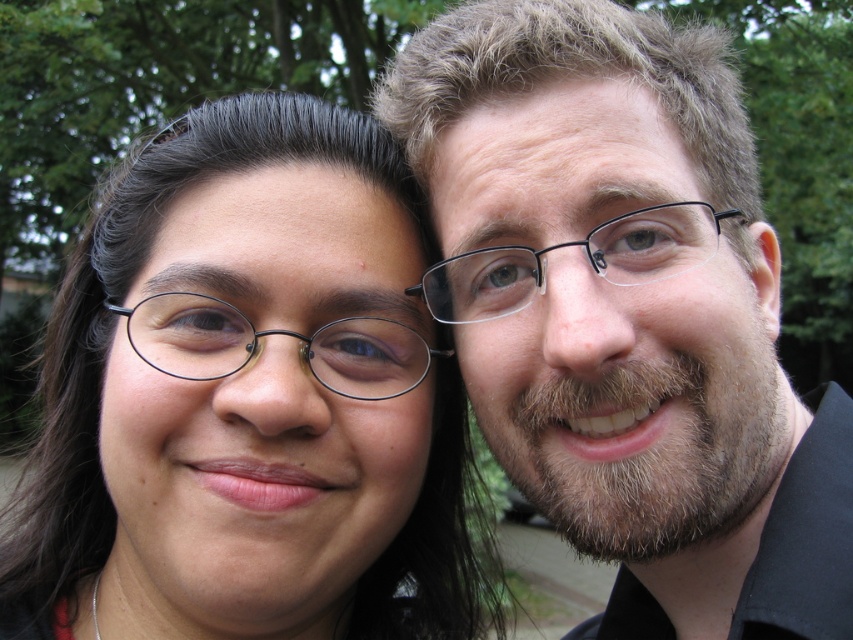
Between smooth black shirt at center and black plastic glasses at center, which one is positioned lower?

smooth black shirt at center is below.

Can you confirm if smooth black shirt at center is thinner than black plastic glasses at center?

No.

Who is more distant from viewer, (686, 355) or (602, 273)?

The point (686, 355) is more distant.

Locate an element on the screen. smooth black shirt at center is located at coordinates (627, 312).

Consider the image. Who is more distant from viewer, [357,342] or [631,220]?

The point [357,342] is more distant.

Which is behind, point (397, 324) or point (697, 208)?

Positioned behind is point (397, 324).

This screenshot has width=853, height=640. Identify the location of black plastic glasses at left. (273, 333).

Is smooth black shirt at center smaller than black plastic glasses at left?

No.

Between smooth black shirt at center and black plastic glasses at left, which one is positioned higher?

black plastic glasses at left

What do you see at coordinates (627, 312) in the screenshot?
I see `smooth black shirt at center` at bounding box center [627, 312].

Find the location of a particular element. smooth black shirt at center is located at coordinates (627, 312).